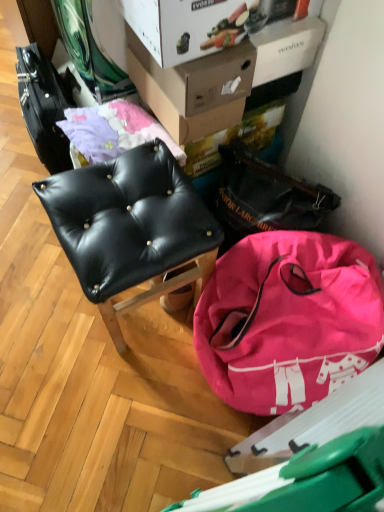
What is the approximate height of black leather chair at center?

It is 19.70 inches.

In order to click on black leather messenger bag at upper right in this screenshot , I will do `click(265, 197)`.

What is the approximate width of pink fabric bag at lower right?

pink fabric bag at lower right is 20.43 inches in width.

Locate an element on the screen. The height and width of the screenshot is (512, 384). black leather chair at center is located at coordinates (131, 228).

Can you tell me how much black leather messenger bag at upper right and pink fabric bag at lower right differ in facing direction?

The facing directions of black leather messenger bag at upper right and pink fabric bag at lower right are 0.000332 degrees apart.

From a real-world perspective, is black leather messenger bag at upper right on pink fabric bag at lower right?

Yes, from a real-world perspective, black leather messenger bag at upper right is on top of pink fabric bag at lower right.

Which of these two, black leather messenger bag at upper right or pink fabric bag at lower right, is thinner?

black leather messenger bag at upper right is thinner.

Is black leather messenger bag at upper right situated inside pink fabric bag at lower right or outside?

The correct answer is: outside.

Considering the relative positions of white cardboard box at upper center, which is counted as the 1th cardboard box, starting from the front, and cardboard box at upper center, which ranks as the 2th cardboard box in front-to-back order, in the image provided, is white cardboard box at upper center, which is counted as the 1th cardboard box, starting from the front, to the left of cardboard box at upper center, which ranks as the 2th cardboard box in front-to-back order, from the viewer's perspective?

Yes.

Between white cardboard box at upper center, the second cardboard box when ordered from back to front, and cardboard box at upper center, which ranks as the 2th cardboard box in front-to-back order, which one has larger width?

Wider between the two is white cardboard box at upper center, the second cardboard box when ordered from back to front.

From a real-world perspective, which is physically above, white cardboard box at upper center, the second cardboard box when ordered from back to front, or cardboard box at upper center, which ranks as the 2th cardboard box in front-to-back order?

white cardboard box at upper center, the second cardboard box when ordered from back to front, from a real-world perspective.

Is black leather messenger bag at upper right taller than black leather chair at center?

In fact, black leather messenger bag at upper right may be shorter than black leather chair at center.

Does black leather messenger bag at upper right come in front of black leather chair at center?

No, black leather messenger bag at upper right is further to the viewer.

Is point (243, 172) positioned behind point (85, 244)?

Yes, point (243, 172) is behind point (85, 244).

Does black leather messenger bag at upper right have a lesser width compared to black leather chair at center?

Indeed, black leather messenger bag at upper right has a lesser width compared to black leather chair at center.

Is pink fabric bag at lower right directly adjacent to black leather chair at center?

No, pink fabric bag at lower right is not next to black leather chair at center.

Based on the photo, between pink fabric bag at lower right and black leather chair at center, which one has less height?

pink fabric bag at lower right is shorter.

Is pink fabric bag at lower right not inside black leather chair at center?

pink fabric bag at lower right is positioned outside black leather chair at center.

Considering the positions of objects black leather chair at center and pink fabric bag at lower right in the image provided, who is more to the right, black leather chair at center or pink fabric bag at lower right?

pink fabric bag at lower right.

Considering the sizes of objects black leather chair at center and pink fabric bag at lower right in the image provided, who is smaller, black leather chair at center or pink fabric bag at lower right?

With smaller size is black leather chair at center.

Locate an element on the screen. The image size is (384, 512). handbag that appears on the right of black leather chair at center is located at coordinates (288, 320).

From the image's perspective, is black leather chair at center located above cardboard box at upper center, arranged as the 1th cardboard box when viewed from the back?

Actually, black leather chair at center appears below cardboard box at upper center, arranged as the 1th cardboard box when viewed from the back, in the image.

Does black leather chair at center touch cardboard box at upper center, which ranks as the 2th cardboard box in front-to-back order?

No, black leather chair at center is not with cardboard box at upper center, which ranks as the 2th cardboard box in front-to-back order.

Is black leather chair at center not inside cardboard box at upper center, arranged as the 1th cardboard box when viewed from the back?

black leather chair at center is positioned outside cardboard box at upper center, arranged as the 1th cardboard box when viewed from the back.

Considering the sizes of objects black leather chair at center and cardboard box at upper center, arranged as the 1th cardboard box when viewed from the back, in the image provided, who is bigger, black leather chair at center or cardboard box at upper center, arranged as the 1th cardboard box when viewed from the back,?

black leather chair at center is bigger.

Which cardboard box is the 2nd one when counting from the back of the black leather chair at center? Please provide its 2D coordinates.

[(194, 88)]

Can you confirm if cardboard box at upper center, arranged as the 1th cardboard box when viewed from the back, is positioned to the right of black leather chair at center?

Yes, cardboard box at upper center, arranged as the 1th cardboard box when viewed from the back, is to the right of black leather chair at center.

Considering the relative sizes of cardboard box at upper center, which ranks as the 2th cardboard box in front-to-back order, and black leather chair at center in the image provided, is cardboard box at upper center, which ranks as the 2th cardboard box in front-to-back order, bigger than black leather chair at center?

Incorrect, cardboard box at upper center, which ranks as the 2th cardboard box in front-to-back order, is not larger than black leather chair at center.

Considering the positions of objects cardboard box at upper center, which ranks as the 2th cardboard box in front-to-back order, and black leather chair at center in the image provided, who is in front, cardboard box at upper center, which ranks as the 2th cardboard box in front-to-back order, or black leather chair at center?

Positioned in front is black leather chair at center.

Identify the location of messenger bag positioned vertically above the pink fabric bag at lower right (from a real-world perspective). (265, 197).

Where is `cardboard box on the right side of white cardboard box at upper center, the second cardboard box when ordered from back to front`? cardboard box on the right side of white cardboard box at upper center, the second cardboard box when ordered from back to front is located at coordinates (194, 88).

When comparing their distances from black leather chair at center, does white cardboard box at upper center, the second cardboard box when ordered from back to front, or pink fabric bag at lower right seem further?

white cardboard box at upper center, the second cardboard box when ordered from back to front, is further to black leather chair at center.

Estimate the real-world distances between objects in this image. Which object is closer to pink fabric bag at lower right, black leather messenger bag at upper right or black leather chair at center?

black leather messenger bag at upper right.

From the image, which object appears to be farther from white cardboard box at upper center, the second cardboard box when ordered from back to front, black leather chair at center or pink fabric bag at lower right?

The object further to white cardboard box at upper center, the second cardboard box when ordered from back to front, is pink fabric bag at lower right.

Based on their spatial positions, is black leather messenger bag at upper right or white cardboard box at upper center, which is counted as the 1th cardboard box, starting from the front, further from pink fabric bag at lower right?

white cardboard box at upper center, which is counted as the 1th cardboard box, starting from the front, is further to pink fabric bag at lower right.

Considering their positions, is cardboard box at upper center, arranged as the 1th cardboard box when viewed from the back, positioned further to black leather messenger bag at upper right than black leather chair at center?

black leather chair at center lies further to black leather messenger bag at upper right than the other object.

From the image, which object appears to be farther from black leather messenger bag at upper right, white cardboard box at upper center, the second cardboard box when ordered from back to front, or black leather chair at center?

Among the two, white cardboard box at upper center, the second cardboard box when ordered from back to front, is located further to black leather messenger bag at upper right.

Looking at the image, which one is located further to pink fabric bag at lower right, cardboard box at upper center, arranged as the 1th cardboard box when viewed from the back, or black leather chair at center?

cardboard box at upper center, arranged as the 1th cardboard box when viewed from the back, is further to pink fabric bag at lower right.

From the image, which object appears to be farther from cardboard box at upper center, which ranks as the 2th cardboard box in front-to-back order, white cardboard box at upper center, the second cardboard box when ordered from back to front, or black leather messenger bag at upper right?

Among the two, black leather messenger bag at upper right is located further to cardboard box at upper center, which ranks as the 2th cardboard box in front-to-back order.

Find the location of `messenger bag between white cardboard box at upper center, which is counted as the 1th cardboard box, starting from the front, and pink fabric bag at lower right from top to bottom`. messenger bag between white cardboard box at upper center, which is counted as the 1th cardboard box, starting from the front, and pink fabric bag at lower right from top to bottom is located at coordinates (265, 197).

This screenshot has height=512, width=384. I want to click on chair between cardboard box at upper center, arranged as the 1th cardboard box when viewed from the back, and pink fabric bag at lower right, in the vertical direction, so (131, 228).

Find the location of a particular element. The height and width of the screenshot is (512, 384). messenger bag between cardboard box at upper center, arranged as the 1th cardboard box when viewed from the back, and black leather chair at center in the up-down direction is located at coordinates (265, 197).

Find the location of a particular element. The image size is (384, 512). cardboard box that lies between white cardboard box at upper center, which is counted as the 1th cardboard box, starting from the front, and pink fabric bag at lower right from top to bottom is located at coordinates (194, 88).